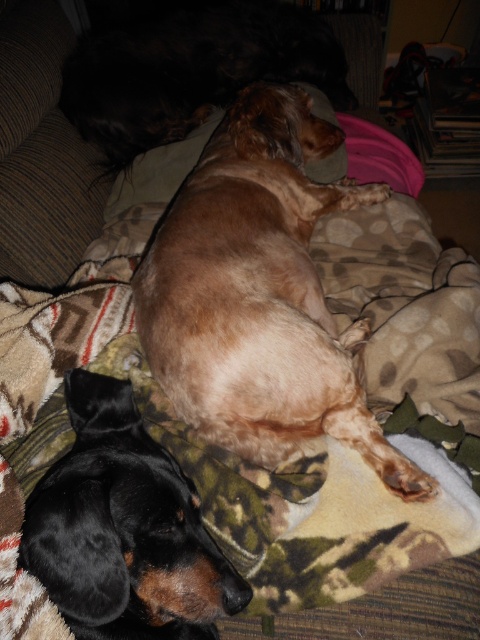
You are a dog owner who wants to ensure both dogs are comfortable. Given the light brown fur at center and the brown fur dog at upper center, which one is taller and needs a higher elevation cushion?

The light brown fur at center is taller than the brown fur dog at upper center, so it would need a higher elevation cushion.

You are taking a photo of the two dogs on the couch. You want to focus on the dog that is closer to the camera. Which point should you focus on, point (122, 628) or point (294, 52)?

You should focus on point (122, 628) because it is closer to the camera than point (294, 52).